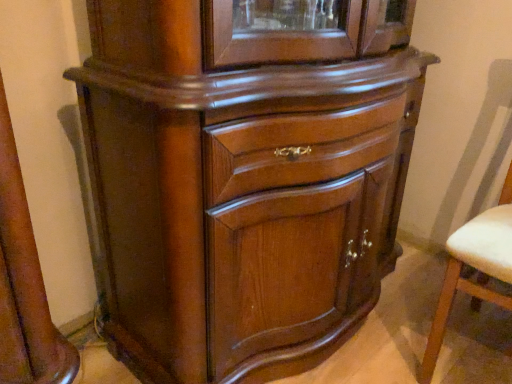
What do you see at coordinates (474, 269) in the screenshot?
I see `white leather swivel chair at right` at bounding box center [474, 269].

You are a GUI agent. You are given a task and a screenshot of the screen. Output one action in this format:
    pyautogui.click(x=<x>, y=<y>)
    Task: Click on the white leather swivel chair at right
    
    Given the screenshot: What is the action you would take?
    pyautogui.click(x=474, y=269)

Image resolution: width=512 pixels, height=384 pixels. In order to click on white leather swivel chair at right in this screenshot , I will do `click(474, 269)`.